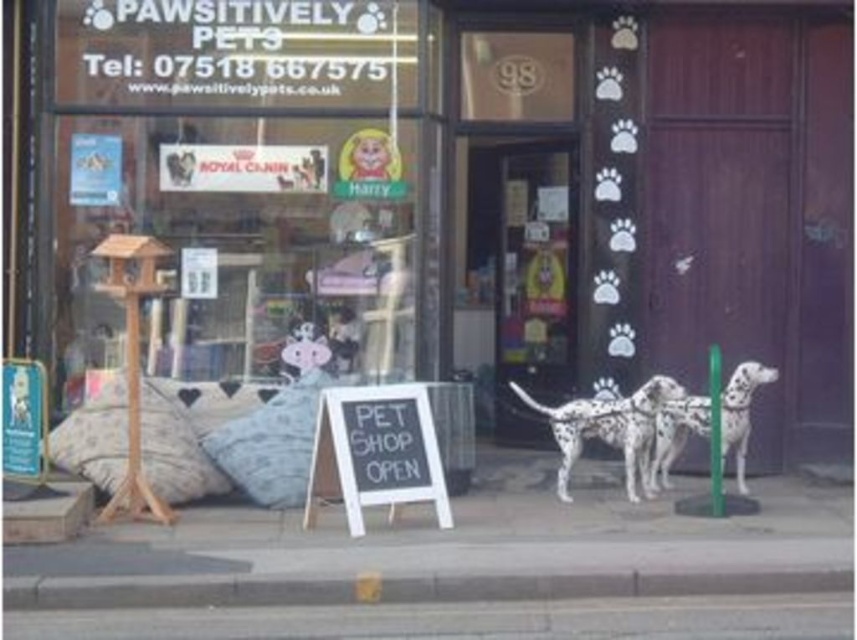
Is black chalkboard sign at center closer to the viewer compared to white spotted fur dog at center?

Yes.

How distant is black chalkboard sign at center from white spotted fur dog at center?

The distance of black chalkboard sign at center from white spotted fur dog at center is 1.95 meters.

Locate an element on the screen. black chalkboard sign at center is located at coordinates (375, 452).

Between point (165, 96) and point (295, 483), which one is positioned behind?

Positioned behind is point (165, 96).

This screenshot has height=640, width=857. What are the coordinates of `matte glass shop window at center` in the screenshot? It's located at (237, 179).

Identify the location of matte glass shop window at center. The image size is (857, 640). (237, 179).

Can you confirm if matte glass shop window at center is smaller than white spotted fur dog at center?

No, matte glass shop window at center is not smaller than white spotted fur dog at center.

Which is more to the left, matte glass shop window at center or white spotted fur dog at center?

matte glass shop window at center

Is point (175, 154) more distant than point (616, 420)?

Yes, it is.

The height and width of the screenshot is (640, 857). What are the coordinates of `matte glass shop window at center` in the screenshot? It's located at (237, 179).